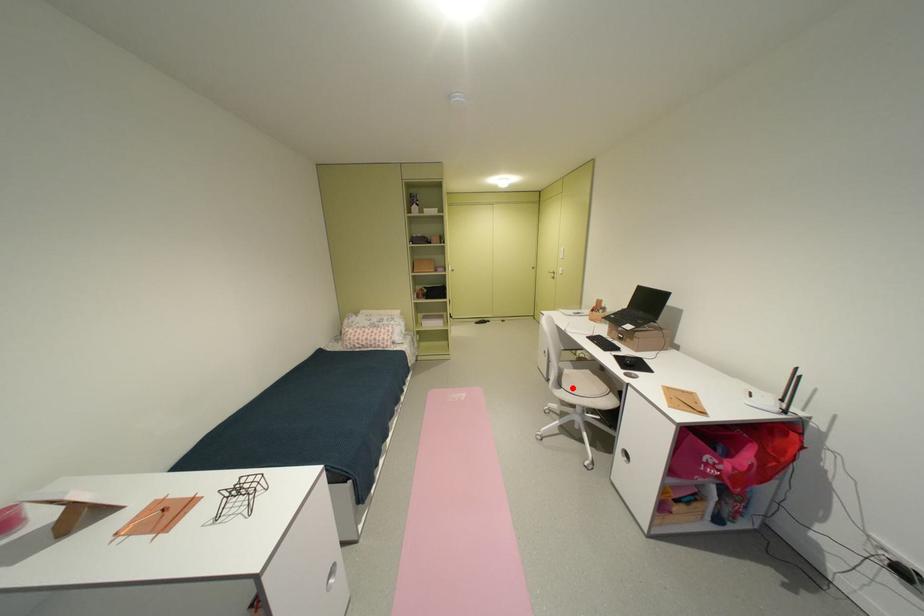
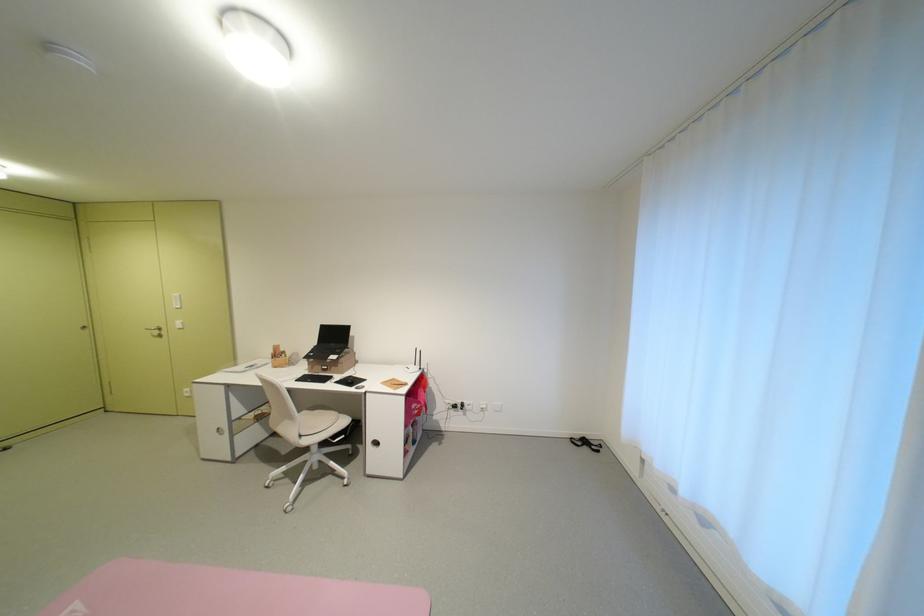
Question: I am providing you with two images of the same scene from different viewpoints. Image1 has a red point marked. In image2, the corresponding 3D location appears at what relative position? Reply with the corresponding letter.

Choices:
 (A) Closer
 (B) Farther

Answer: (B)